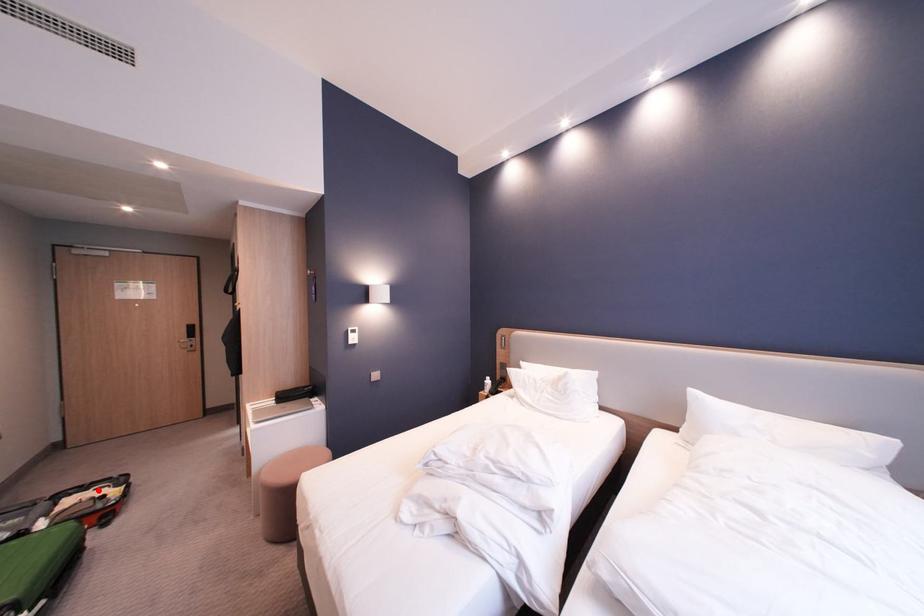
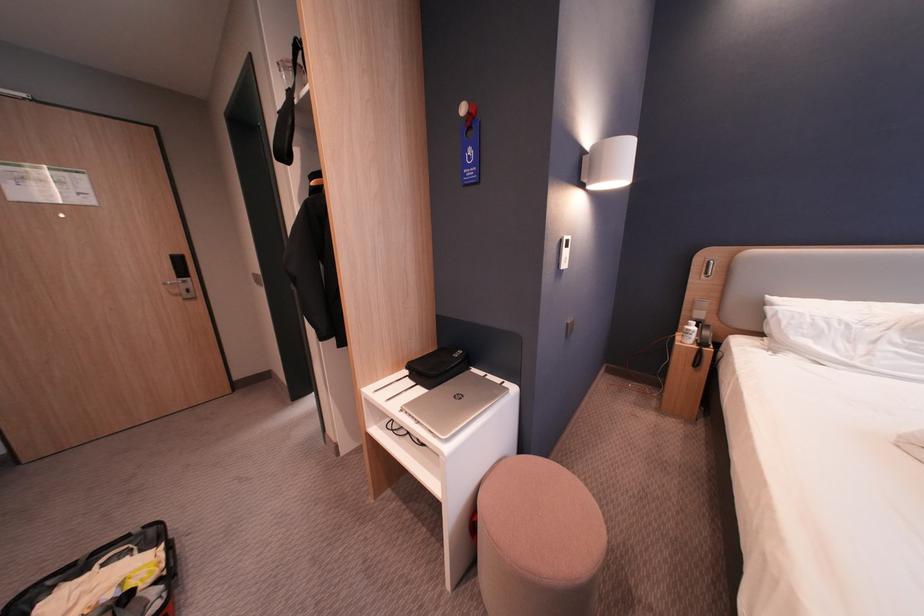
The point at the highlighted location is marked in the first image. Where is the corresponding point in the second image?

(99, 572)